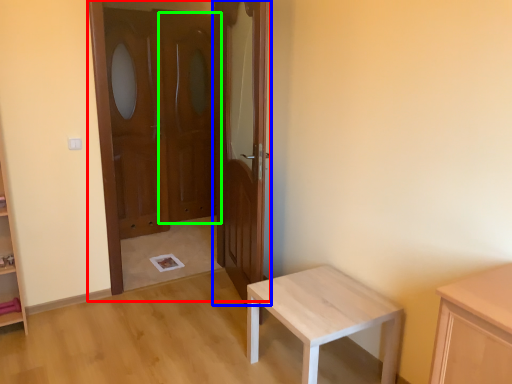
Question: Which is nearer to the door (highlighted by a red box)? door (highlighted by a blue box) or screen door (highlighted by a green box).

Choices:
 (A) door
 (B) screen door

Answer: (B)